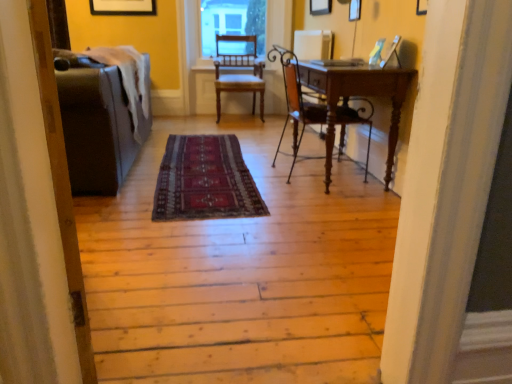
Locate an element on the screen. This screenshot has width=512, height=384. free space behind matte black couch at left is located at coordinates (126, 251).